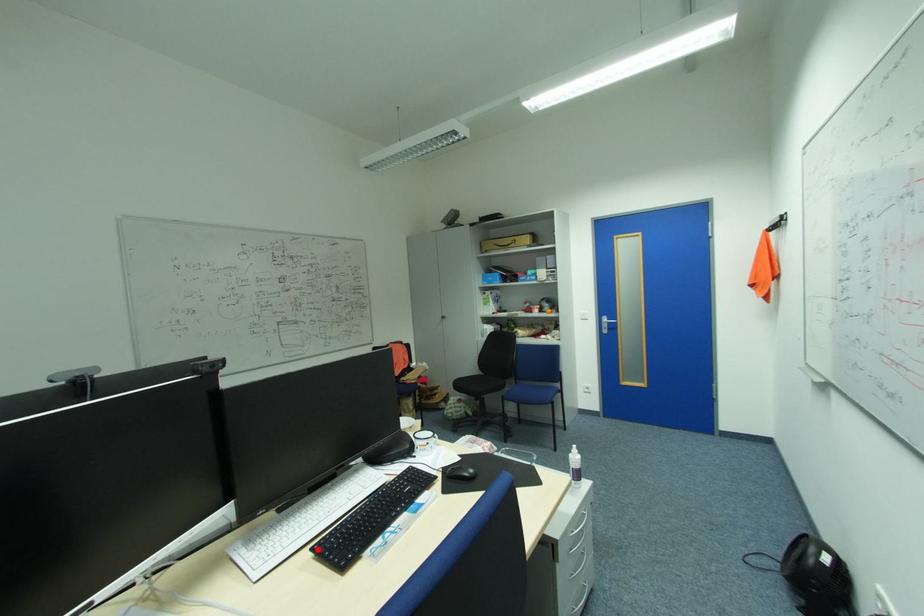
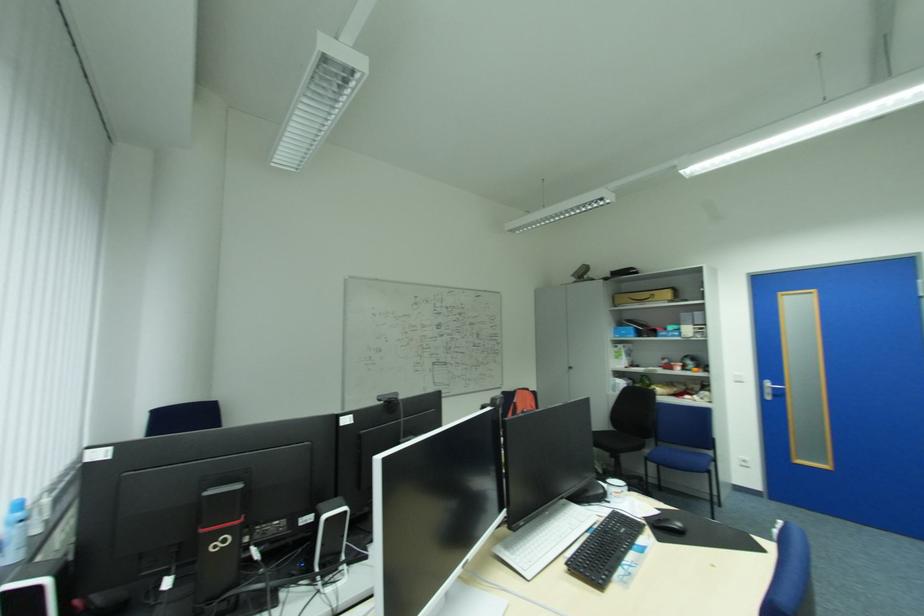
Locate, in the second image, the point that corresponds to the highlighted location in the first image.

(573, 565)